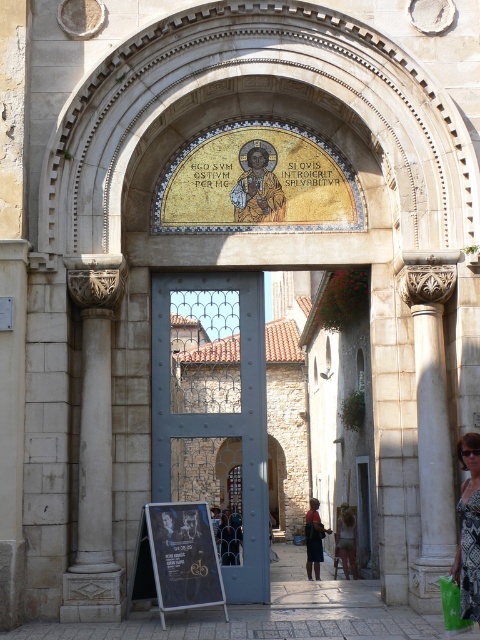
You are a visitor standing at the entrance of the building. You notice the white stone column at left and the dark brown leather bag at center. Which object is positioned higher from the ground?

The white stone column at left is above the dark brown leather bag at center, so it is positioned higher from the ground.

You are standing in front of the grand entrance and see the patterned fabric dress at center and the green plastic shopping bag at lower right. Which object is higher up?

The patterned fabric dress at center is located above the green plastic shopping bag at lower right, so it is higher up.